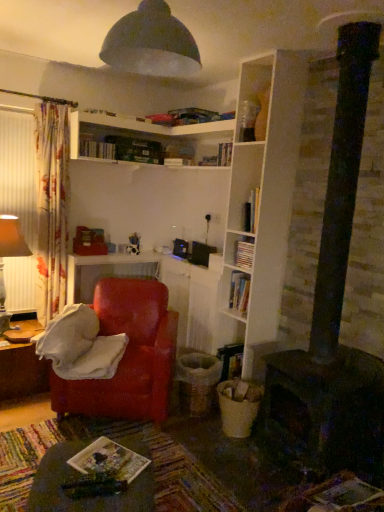
The image size is (384, 512). What do you see at coordinates (21, 371) in the screenshot?
I see `wooden table at lower left, the 2th table when ordered from right to left` at bounding box center [21, 371].

Where is `white matte bookshelf at center, placed as the 3th book when sorted from left to right`? Image resolution: width=384 pixels, height=512 pixels. white matte bookshelf at center, placed as the 3th book when sorted from left to right is located at coordinates (244, 253).

At what (x,y) coordinates should I click in order to perform the action: click on wooden tray at lower center, acting as the 2th table starting from the back. Please return your answer as a coordinate pair (x, y). The image size is (384, 512). Looking at the image, I should click on (82, 500).

This screenshot has height=512, width=384. Describe the element at coordinates (82, 500) in the screenshot. I see `wooden tray at lower center, the 1th table in the front-to-back sequence` at that location.

The image size is (384, 512). What do you see at coordinates (128, 355) in the screenshot? I see `matte red armchair at left` at bounding box center [128, 355].

Where is `wooden table at lower left, which is counted as the 1th table, starting from the left`? wooden table at lower left, which is counted as the 1th table, starting from the left is located at coordinates (21, 371).

Is wooden board game at lower center, placed as the first book when sorted from front to back, bigger than black matte fireplace at lower right?

No, wooden board game at lower center, placed as the first book when sorted from front to back, is not bigger than black matte fireplace at lower right.

This screenshot has height=512, width=384. In order to click on book that is the 1st object above the black matte fireplace at lower right (from a real-world perspective) in this screenshot , I will do 109,461.

In the scene shown: Can you tell me how much wooden board game at lower center, which is the 2th book in left-to-right order, and wooden tray at lower center, acting as the 2th table starting from the back, differ in facing direction?

They differ by 52.9 degrees in their facing directions.

Considering the positions of objects wooden board game at lower center, which is the 2th book in left-to-right order, and wooden tray at lower center, the 1th table in the front-to-back sequence, in the image provided, who is more to the right, wooden board game at lower center, which is the 2th book in left-to-right order, or wooden tray at lower center, the 1th table in the front-to-back sequence,?

Positioned to the right is wooden board game at lower center, which is the 2th book in left-to-right order.

The image size is (384, 512). Identify the location of the 1st book directly above the wooden tray at lower center, acting as the 2th table starting from the back (from a real-world perspective). (109, 461).

Considering the positions of point (105, 471) and point (45, 510), is point (105, 471) closer or farther from the camera than point (45, 510)?

Point (105, 471) appears to be farther away from the viewer than point (45, 510).

Where is `book lying on the left of matte red armchair at left`? This screenshot has width=384, height=512. book lying on the left of matte red armchair at left is located at coordinates (96, 149).

From the image's perspective, between hardcover book at upper center, the 1th book viewed from the back, and matte red armchair at left, which one is located above?

hardcover book at upper center, the 1th book viewed from the back, is shown above in the image.

Looking at their sizes, would you say hardcover book at upper center, the 3th book in the bottom-to-top sequence, is wider or thinner than matte red armchair at left?

Considering their sizes, hardcover book at upper center, the 3th book in the bottom-to-top sequence, looks slimmer than matte red armchair at left.

Does hardcover book at upper center, the 1th book viewed from the back, lie behind matte red armchair at left?

Yes, it is.

From a real-world perspective, is black matte fireplace at lower right above or below matte red armchair at left?

Clearly, from a real-world perspective, black matte fireplace at lower right is below matte red armchair at left.

What's the angular difference between black matte fireplace at lower right and matte red armchair at left's facing directions?

They differ by 53.5 degrees in their facing directions.

Is point (269, 422) positioned after point (116, 388)?

That is False.

Would you say black matte fireplace at lower right contains matte red armchair at left?

No.

Considering the sizes of hardcover book at upper center, arranged as the first book when viewed from the left, and matte brown table lamp at left in the image, is hardcover book at upper center, arranged as the first book when viewed from the left, wider or thinner than matte brown table lamp at left?

Clearly, hardcover book at upper center, arranged as the first book when viewed from the left, has less width compared to matte brown table lamp at left.

Is hardcover book at upper center, which is the 1th book from top to bottom, facing away from matte brown table lamp at left?

No, matte brown table lamp at left is not at the back of hardcover book at upper center, which is the 1th book from top to bottom.

Measure the distance between hardcover book at upper center, positioned as the 3th book in right-to-left order, and matte brown table lamp at left.

A distance of 33.61 inches exists between hardcover book at upper center, positioned as the 3th book in right-to-left order, and matte brown table lamp at left.

Consider the image. Would you say wooden tray at lower center, the 1th table in the front-to-back sequence, is inside or outside wooden table at lower left, which is counted as the 1th table, starting from the left?

wooden tray at lower center, the 1th table in the front-to-back sequence, cannot be found inside wooden table at lower left, which is counted as the 1th table, starting from the left.

This screenshot has width=384, height=512. What are the coordinates of `table that is under the wooden tray at lower center, positioned as the first table in right-to-left order (from a real-world perspective)` in the screenshot? It's located at (21, 371).

From the picture: From the image's perspective, relative to wooden table at lower left, which is counted as the 1th table, starting from the left, is wooden tray at lower center, marked as the 2th table in a left-to-right arrangement, above or below?

wooden tray at lower center, marked as the 2th table in a left-to-right arrangement, is situated lower than wooden table at lower left, which is counted as the 1th table, starting from the left, in the image.

Is the depth of wooden tray at lower center, the 1th table in the front-to-back sequence, less than that of wooden table at lower left, the first table viewed from the back?

Yes, the depth of wooden tray at lower center, the 1th table in the front-to-back sequence, is less than that of wooden table at lower left, the first table viewed from the back.

Considering the sizes of wooden board game at lower center, the third book when ordered from back to front, and matte red armchair at left in the image, is wooden board game at lower center, the third book when ordered from back to front, taller or shorter than matte red armchair at left?

Clearly, wooden board game at lower center, the third book when ordered from back to front, is shorter compared to matte red armchair at left.

From a real-world perspective, is wooden board game at lower center, the third book when ordered from back to front, physically located above or below matte red armchair at left?

In terms of real-world spatial position, wooden board game at lower center, the third book when ordered from back to front, is below matte red armchair at left.

Considering the sizes of objects wooden board game at lower center, the third book when ordered from back to front, and matte red armchair at left in the image provided, who is thinner, wooden board game at lower center, the third book when ordered from back to front, or matte red armchair at left?

wooden board game at lower center, the third book when ordered from back to front.

Could you tell me if wooden board game at lower center, which is counted as the third book, starting from the top, is turned towards matte red armchair at left?

No, wooden board game at lower center, which is counted as the third book, starting from the top, is not aimed at matte red armchair at left.

Where is `the 2nd book to the left when counting from the black matte fireplace at lower right`? The image size is (384, 512). the 2nd book to the left when counting from the black matte fireplace at lower right is located at coordinates (109, 461).

You are a GUI agent. You are given a task and a screenshot of the screen. Output one action in this format:
    pyautogui.click(x=<x>, y=<y>)
    Task: Click on the table lying below the wooden board game at lower center, positioned as the 2th book in right-to-left order (from the image's perspective)
    The image size is (384, 512).
    Given the screenshot: What is the action you would take?
    pyautogui.click(x=82, y=500)

From the image, which object appears to be farther from wooden table at lower left, which ranks as the second table in front-to-back order, wooden board game at lower center, positioned as the 2th book in right-to-left order, or white wooden shelves at upper center?

white wooden shelves at upper center lies further to wooden table at lower left, which ranks as the second table in front-to-back order, than the other object.

Based on their spatial positions, is hardcover book at upper center, the 3th book in the bottom-to-top sequence, or wooden tray at lower center, positioned as the first table in right-to-left order, closer to white wooden shelves at upper center?

hardcover book at upper center, the 3th book in the bottom-to-top sequence, is closer to white wooden shelves at upper center.

Based on their spatial positions, is hardcover book at upper center, arranged as the first book when viewed from the left, or matte red armchair at left further from matte black lampshade at upper center?

matte red armchair at left is further to matte black lampshade at upper center.

Looking at the image, which one is located closer to matte black lampshade at upper center, white wooden shelves at upper center or white matte bookshelf at center, which is counted as the second book, starting from the back?

Based on the image, white wooden shelves at upper center appears to be nearer to matte black lampshade at upper center.

Looking at the image, which one is located closer to matte black lampshade at upper center, white matte bookshelf at center, positioned as the 2th book in bottom-to-top order, or matte red armchair at left?

Among the two, white matte bookshelf at center, positioned as the 2th book in bottom-to-top order, is located nearer to matte black lampshade at upper center.

Considering their positions, is matte black lampshade at upper center positioned closer to white matte bookshelf at center, placed as the 3th book when sorted from left to right, than matte brown table lamp at left?

matte black lampshade at upper center is positioned closer to the anchor white matte bookshelf at center, placed as the 3th book when sorted from left to right.

Estimate the real-world distances between objects in this image. Which object is further from matte black lampshade at upper center, white wooden shelves at upper center or wooden board game at lower center, which is the 2th book in left-to-right order?

wooden board game at lower center, which is the 2th book in left-to-right order, is further to matte black lampshade at upper center.

Looking at the image, which one is located further to black matte fireplace at lower right, white matte bookshelf at center, which is counted as the second book, starting from the back, or matte black lampshade at upper center?

Based on the image, matte black lampshade at upper center appears to be further to black matte fireplace at lower right.

Find the location of a particular element. fireplace between white wooden shelves at upper center and wooden board game at lower center, acting as the first book starting from the bottom, in the vertical direction is located at coordinates (325, 411).

The image size is (384, 512). Find the location of `table lamp between wooden table at lower left, which is counted as the 1th table, starting from the left, and white matte bookshelf at center, the 2th book viewed from the top`. table lamp between wooden table at lower left, which is counted as the 1th table, starting from the left, and white matte bookshelf at center, the 2th book viewed from the top is located at coordinates (9, 256).

Identify the location of chair between matte brown table lamp at left and white matte bookshelf at center, which is counted as the second book, starting from the back, from left to right. (128, 355).

Identify the location of table lamp between matte black lampshade at upper center and white wooden shelves at upper center along the z-axis. Image resolution: width=384 pixels, height=512 pixels. (9, 256).